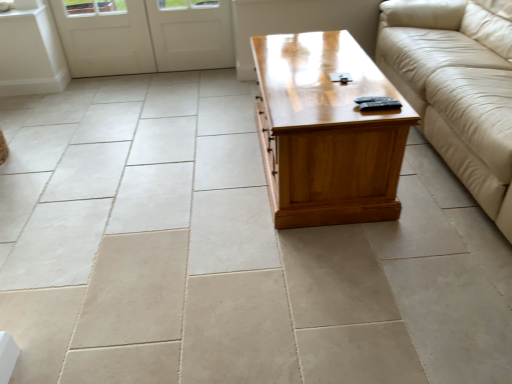
Question: From the image's perspective, is white matte door at upper left above beige leather couch at right?

Choices:
 (A) yes
 (B) no

Answer: (A)

Question: Is white matte door at upper left directly adjacent to beige leather couch at right?

Choices:
 (A) no
 (B) yes

Answer: (A)

Question: Is white matte door at upper left oriented towards beige leather couch at right?

Choices:
 (A) yes
 (B) no

Answer: (B)

Question: From a real-world perspective, is white matte door at upper left below beige leather couch at right?

Choices:
 (A) yes
 (B) no

Answer: (A)

Question: From a real-world perspective, is white matte door at upper left on top of beige leather couch at right?

Choices:
 (A) no
 (B) yes

Answer: (A)

Question: From a real-world perspective, relative to white matte door at upper left, is beige leather couch at right vertically above or below?

Choices:
 (A) above
 (B) below

Answer: (A)

Question: Is point (455, 18) closer or farther from the camera than point (71, 31)?

Choices:
 (A) farther
 (B) closer

Answer: (B)

Question: Which is correct: beige leather couch at right is inside white matte door at upper left, or outside of it?

Choices:
 (A) inside
 (B) outside

Answer: (B)

Question: From the image's perspective, is beige leather couch at right located above or below white matte door at upper left?

Choices:
 (A) above
 (B) below

Answer: (B)

Question: Is light brown wood coffee table at center situated inside beige leather couch at right or outside?

Choices:
 (A) inside
 (B) outside

Answer: (B)

Question: Considering the positions of light brown wood coffee table at center and beige leather couch at right in the image, is light brown wood coffee table at center wider or thinner than beige leather couch at right?

Choices:
 (A) wide
 (B) thin

Answer: (B)

Question: Considering the positions of light brown wood coffee table at center and beige leather couch at right in the image, is light brown wood coffee table at center bigger or smaller than beige leather couch at right?

Choices:
 (A) small
 (B) big

Answer: (A)

Question: Is light brown wood coffee table at center taller or shorter than beige leather couch at right?

Choices:
 (A) short
 (B) tall

Answer: (A)

Question: Based on their sizes in the image, would you say white matte door at upper left is bigger or smaller than light brown wood coffee table at center?

Choices:
 (A) small
 (B) big

Answer: (A)

Question: Is white matte door at upper left inside or outside of light brown wood coffee table at center?

Choices:
 (A) inside
 (B) outside

Answer: (B)